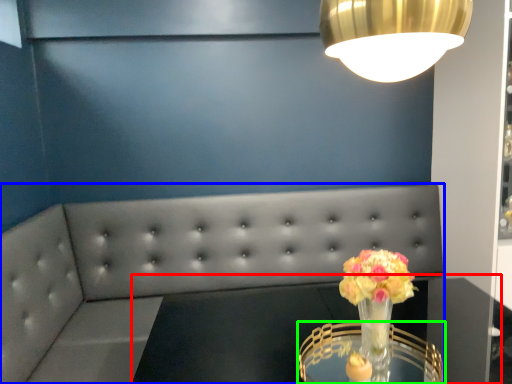
Question: Considering the real-world distances, which object is closest to round table (highlighted by a red box)? studio couch (highlighted by a blue box) or table (highlighted by a green box).

Choices:
 (A) studio couch
 (B) table

Answer: (B)